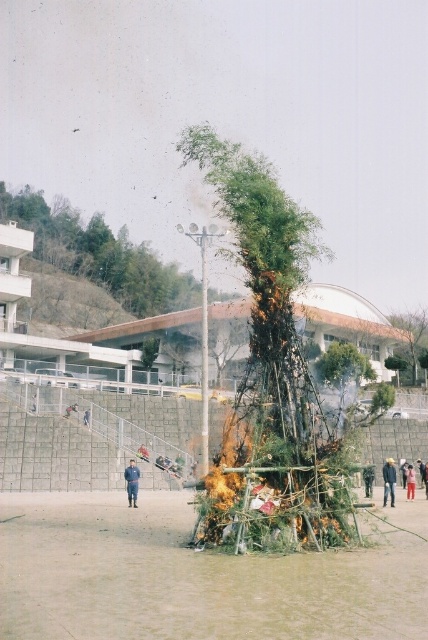
Question: Estimate the real-world distances between objects in this image. Which object is closer to the burning bamboo at center?

Choices:
 (A) blue jeans at center
 (B) light brown fabric jacket at lower right

Answer: (B)

Question: Is blue uniform at center positioned in front of dark blue fabric at center?

Choices:
 (A) no
 (B) yes

Answer: (A)

Question: Which point is farther to the camera?

Choices:
 (A) (73, 269)
 (B) (425, 326)
 (C) (389, 472)
 (D) (410, 468)

Answer: (A)

Question: Which point is farther from the camera taking this photo?

Choices:
 (A) (422, 481)
 (B) (365, 497)
 (C) (415, 316)
 (D) (124, 476)

Answer: (C)

Question: Does green bamboo at center appear over blue uniform at center?

Choices:
 (A) yes
 (B) no

Answer: (A)

Question: Can you confirm if burning bamboo at center is positioned to the left of blue uniform at center?

Choices:
 (A) yes
 (B) no

Answer: (B)